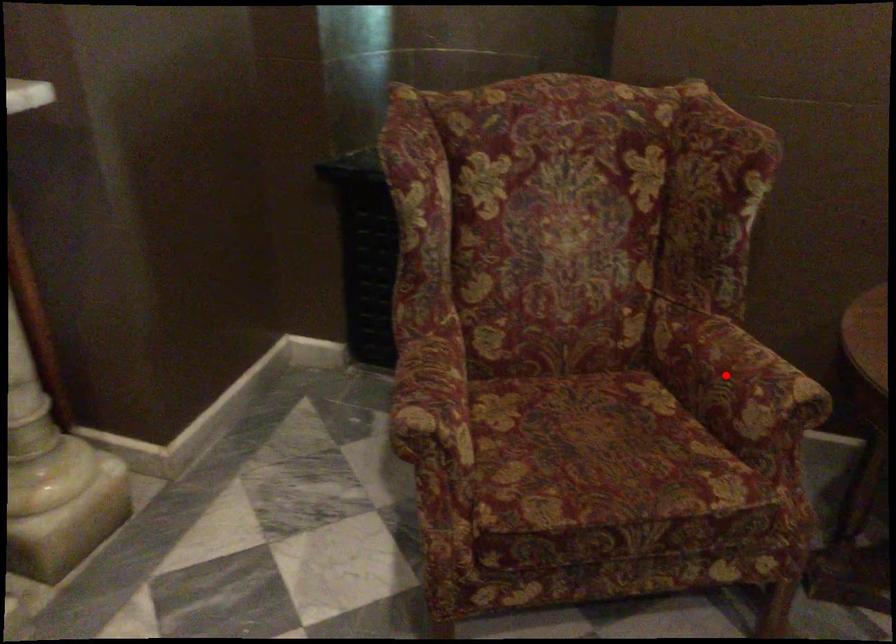
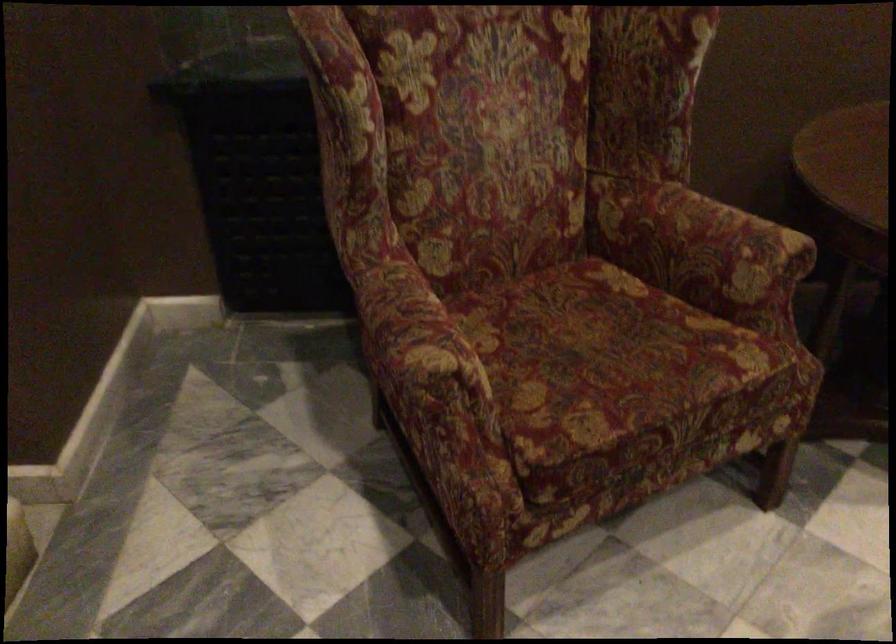
Where in the second image is the point corresponding to the highlighted location from the first image?

(700, 243)